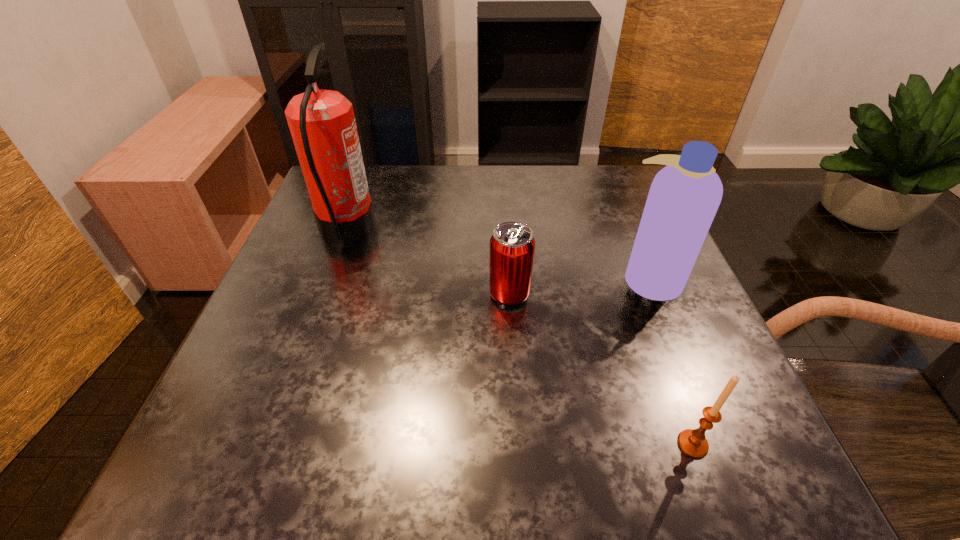
Where is `vacant space at the far right corner of the desktop`? The height and width of the screenshot is (540, 960). vacant space at the far right corner of the desktop is located at coordinates (591, 192).

Image resolution: width=960 pixels, height=540 pixels. In order to click on vacant space at the near right corner of the desktop in this screenshot , I will do `click(764, 454)`.

Find the location of a particular element. free spot between the candle_holder and the shampoo is located at coordinates (671, 361).

Identify the location of empty location between the fire extinguisher and the nearest object. (519, 338).

The image size is (960, 540). Find the location of `empty location between the leftmost object and the soda can`. empty location between the leftmost object and the soda can is located at coordinates (428, 262).

The image size is (960, 540). I want to click on free space between the nearest object and the third object from right to left, so click(x=601, y=369).

Image resolution: width=960 pixels, height=540 pixels. Identify the location of vacant space that is in between the candle_holder and the fire extinguisher. (519, 338).

This screenshot has height=540, width=960. I want to click on free spot between the third object from right to left and the tallest object, so click(428, 262).

Locate which object is the third closest to the nearest object. Please provide its 2D coordinates. Your answer should be formatted as a tuple, i.e. [(x, y)], where the tuple contains the x and y coordinates of a point satisfying the conditions above.

[(322, 124)]

Where is `object that stands as the second closest to the soda can`? The height and width of the screenshot is (540, 960). object that stands as the second closest to the soda can is located at coordinates (322, 124).